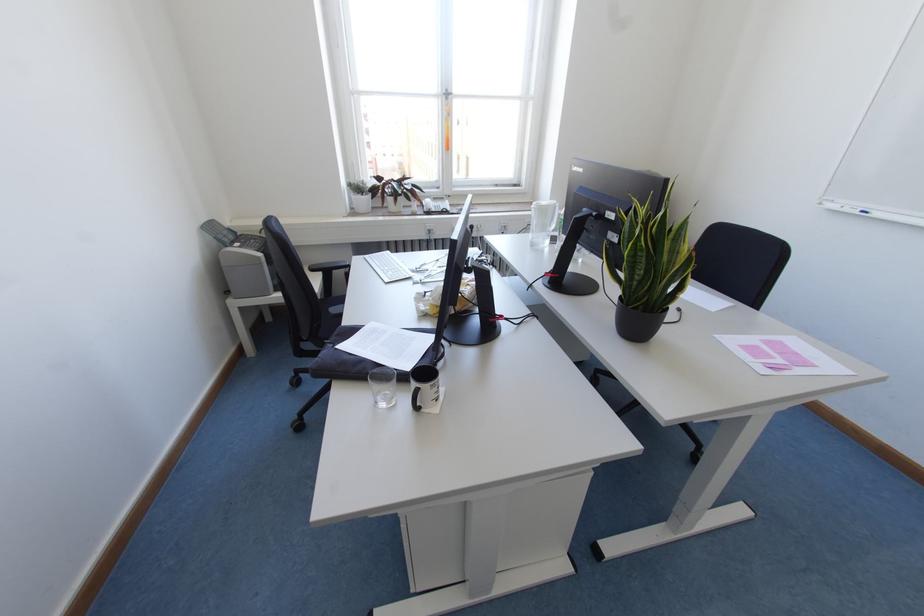
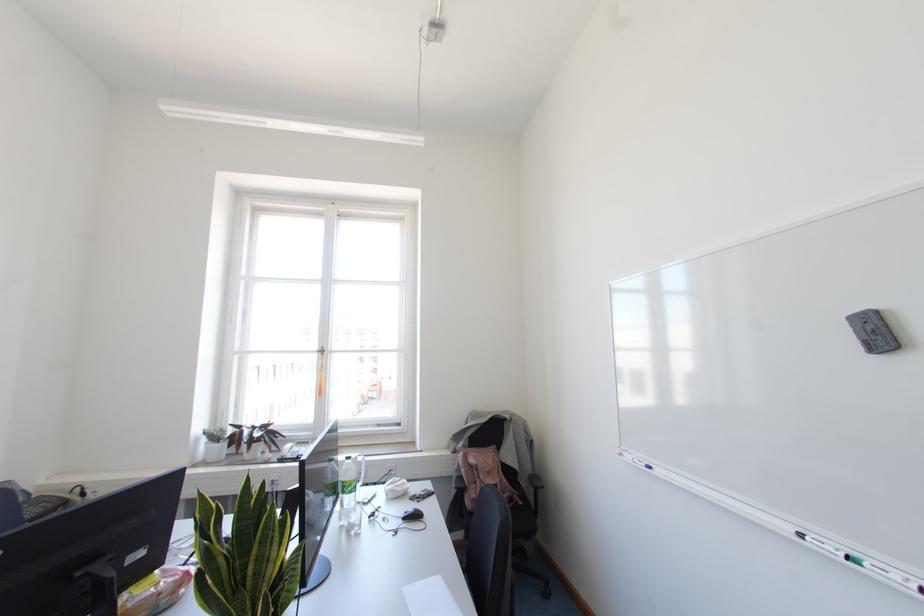
The point at (253, 238) is marked in the first image. Where is the corresponding point in the second image?

(46, 501)